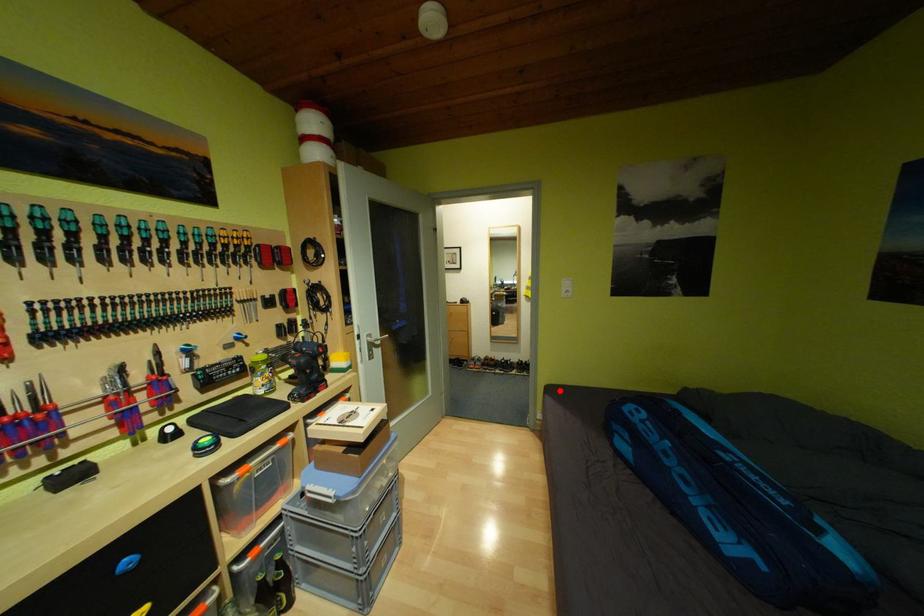
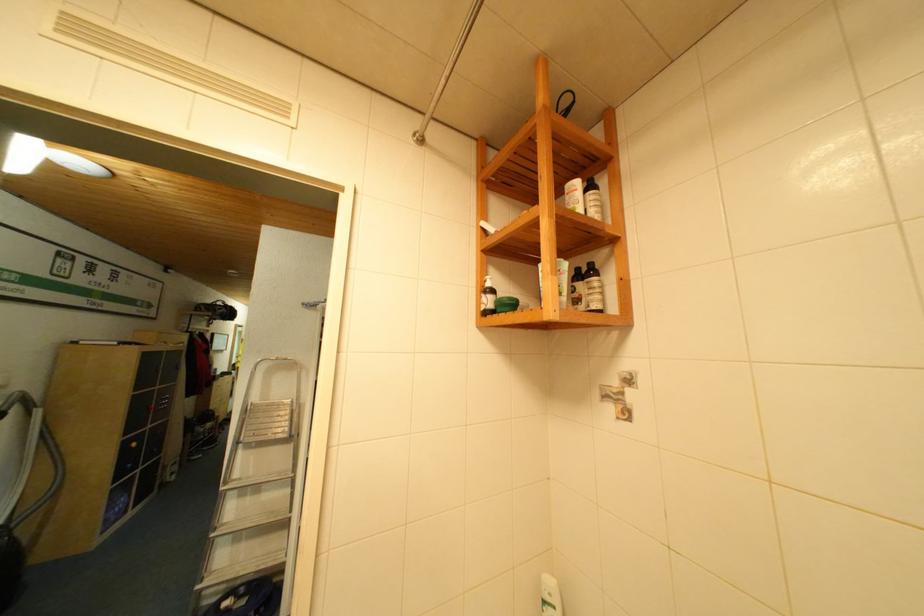
Question: I am providing you with two images of the same scene from different viewpoints. A red point is marked on the first image. At the location where the point appears in image 1, is it still visible in image 2?

Choices:
 (A) Yes
 (B) No

Answer: (B)